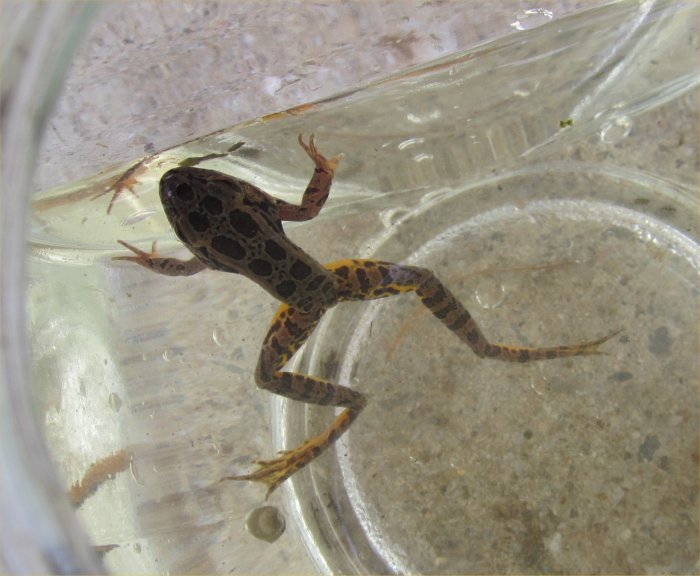
Where is `glass bowl`? Image resolution: width=700 pixels, height=576 pixels. glass bowl is located at coordinates (92, 52).